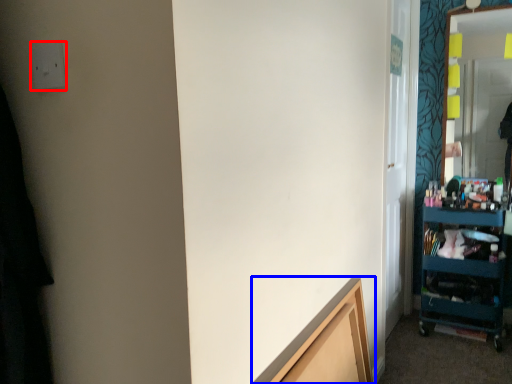
Question: Which object is closer to the camera taking this photo, electric outlet (highlighted by a red box) or cabinetry (highlighted by a blue box)?

Choices:
 (A) electric outlet
 (B) cabinetry

Answer: (A)